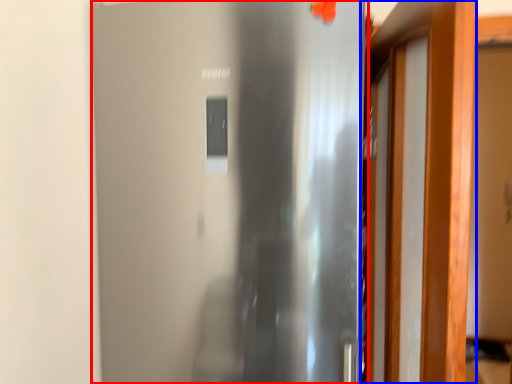
Question: Among these objects, which one is farthest to the camera, door (highlighted by a red box) or door (highlighted by a blue box)?

Choices:
 (A) door
 (B) door

Answer: (A)